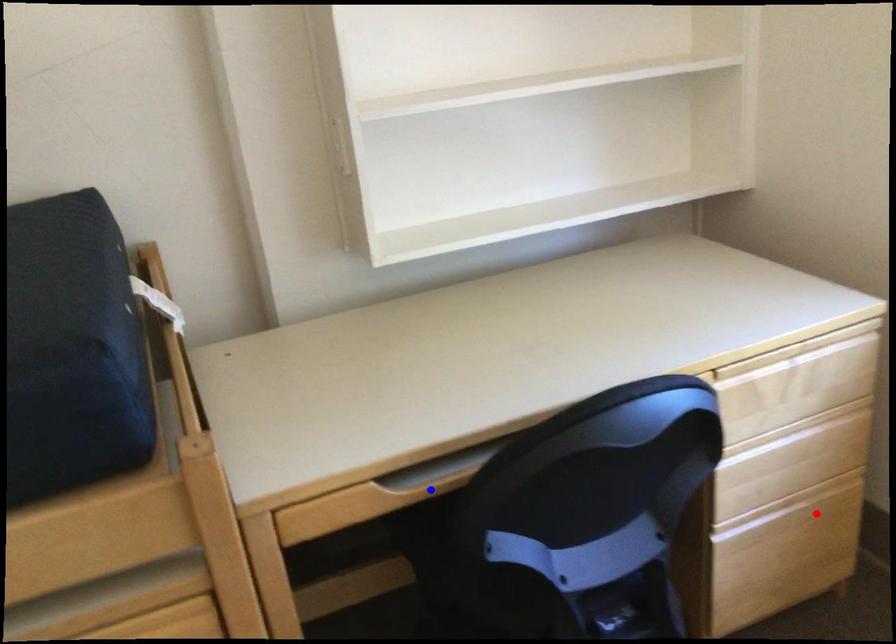
Question: Two points are marked on the image. Which point is closer to the camera?

Choices:
 (A) Blue point is closer.
 (B) Red point is closer.

Answer: (A)